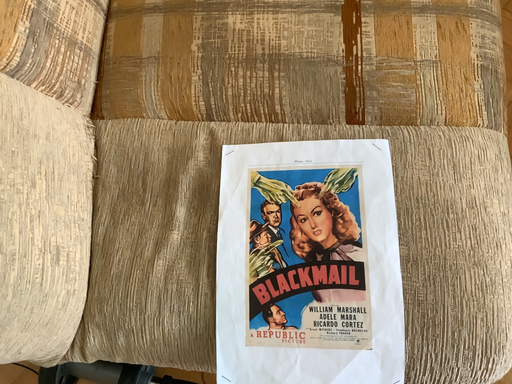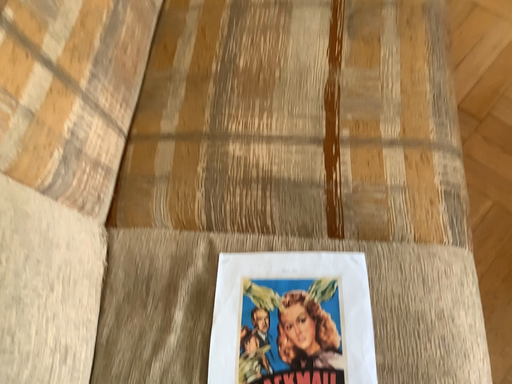
Question: How did the camera likely rotate when shooting the video?

Choices:
 (A) rotated downward
 (B) rotated upward

Answer: (B)